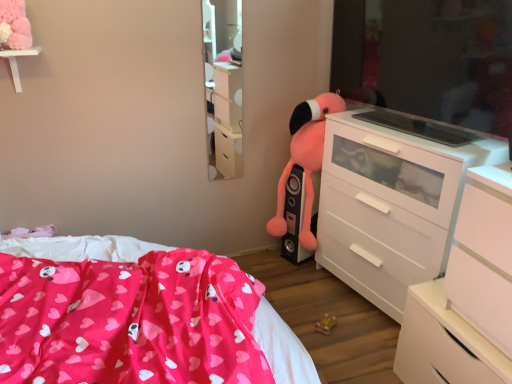
Question: From a real-world perspective, is fluffy pink stuffed animal at center-right physically below light wood mirror at upper center?

Choices:
 (A) yes
 (B) no

Answer: (A)

Question: Can you confirm if fluffy pink stuffed animal at center-right is shorter than light wood mirror at upper center?

Choices:
 (A) no
 (B) yes

Answer: (B)

Question: From the image's perspective, is fluffy pink stuffed animal at center-right below light wood mirror at upper center?

Choices:
 (A) yes
 (B) no

Answer: (A)

Question: Is fluffy pink stuffed animal at center-right bigger than light wood mirror at upper center?

Choices:
 (A) no
 (B) yes

Answer: (B)

Question: Would you say fluffy pink stuffed animal at center-right is outside light wood mirror at upper center?

Choices:
 (A) yes
 (B) no

Answer: (A)

Question: Is white matte chest of drawers at right, the 3th chest of drawers in the back-to-front sequence, in front of or behind white glossy chest of drawers at lower right, which is the 2th chest of drawers from back to front, in the image?

Choices:
 (A) front
 (B) behind

Answer: (A)

Question: Which is correct: white matte chest of drawers at right, the 3th chest of drawers in the back-to-front sequence, is inside white glossy chest of drawers at lower right, which is the 2th chest of drawers from back to front, or outside of it?

Choices:
 (A) outside
 (B) inside

Answer: (A)

Question: From the image's perspective, is white matte chest of drawers at right, the first chest of drawers viewed from the front, above or below white glossy chest of drawers at lower right, acting as the 2th chest of drawers starting from the front?

Choices:
 (A) above
 (B) below

Answer: (A)

Question: Is white matte chest of drawers at right, the first chest of drawers viewed from the front, wider or thinner than white glossy chest of drawers at lower right, which is the 2th chest of drawers from back to front?

Choices:
 (A) thin
 (B) wide

Answer: (A)

Question: Considering the relative positions of light wood mirror at upper center and white glossy chest of drawers at lower right, acting as the 2th chest of drawers starting from the front, in the image provided, is light wood mirror at upper center to the left or to the right of white glossy chest of drawers at lower right, acting as the 2th chest of drawers starting from the front,?

Choices:
 (A) right
 (B) left

Answer: (B)

Question: Is light wood mirror at upper center inside or outside of white glossy chest of drawers at lower right, acting as the 2th chest of drawers starting from the front?

Choices:
 (A) outside
 (B) inside

Answer: (A)

Question: Considering the positions of light wood mirror at upper center and white glossy chest of drawers at lower right, which is the 2th chest of drawers from back to front, in the image, is light wood mirror at upper center wider or thinner than white glossy chest of drawers at lower right, which is the 2th chest of drawers from back to front,?

Choices:
 (A) wide
 (B) thin

Answer: (B)

Question: In terms of size, does light wood mirror at upper center appear bigger or smaller than white glossy chest of drawers at lower right, which is the 2th chest of drawers from back to front?

Choices:
 (A) big
 (B) small

Answer: (B)

Question: Looking at the image, does white matte chest of drawers at right, the first chest of drawers viewed from the front, seem bigger or smaller compared to fluffy pink stuffed animal at center-right?

Choices:
 (A) big
 (B) small

Answer: (B)

Question: Considering the positions of white matte chest of drawers at right, the first chest of drawers viewed from the front, and fluffy pink stuffed animal at center-right in the image, is white matte chest of drawers at right, the first chest of drawers viewed from the front, wider or thinner than fluffy pink stuffed animal at center-right?

Choices:
 (A) thin
 (B) wide

Answer: (B)